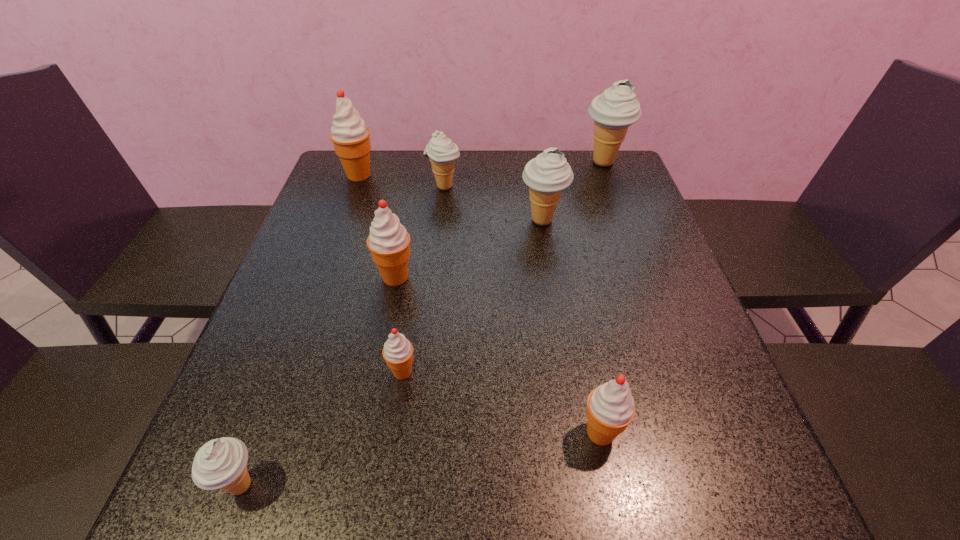
You are a GUI agent. You are given a task and a screenshot of the screen. Output one action in this format:
    pyautogui.click(x=<x>, y=<y>)
    Task: Click on the free space at the near edge of the desktop
    The image size is (960, 540).
    Given the screenshot: What is the action you would take?
    pyautogui.click(x=571, y=494)

Locate an element on the screen. The height and width of the screenshot is (540, 960). vacant space at the left edge is located at coordinates (355, 223).

Locate an element on the screen. free space at the right edge of the desktop is located at coordinates (671, 442).

Identify the location of vacant space at the far left corner of the desktop. (333, 173).

In the image, there is a desktop. At what (x,y) coordinates should I click in order to perform the action: click on free space at the far right corner. Please return your answer as a coordinate pair (x, y). Image resolution: width=960 pixels, height=540 pixels. Looking at the image, I should click on (590, 194).

Where is `free space between the third beige icecream from right to left and the third nearest object`? The height and width of the screenshot is (540, 960). free space between the third beige icecream from right to left and the third nearest object is located at coordinates (423, 279).

Identify the location of vacant space that's between the sixth farthest object and the second farthest red icecream. The height and width of the screenshot is (540, 960). (398, 324).

You are a GUI agent. You are given a task and a screenshot of the screen. Output one action in this format:
    pyautogui.click(x=<x>, y=<y>)
    Task: Click on the free point between the fifth farthest object and the smallest beige icecream
    This screenshot has width=960, height=540.
    Given the screenshot: What is the action you would take?
    pyautogui.click(x=319, y=381)

The width and height of the screenshot is (960, 540). Identify the location of vacant region between the biggest red icecream and the second nearest object. (480, 303).

Where is `empty space that is in between the rightmost object and the third nearest object`? This screenshot has height=540, width=960. empty space that is in between the rightmost object and the third nearest object is located at coordinates (503, 267).